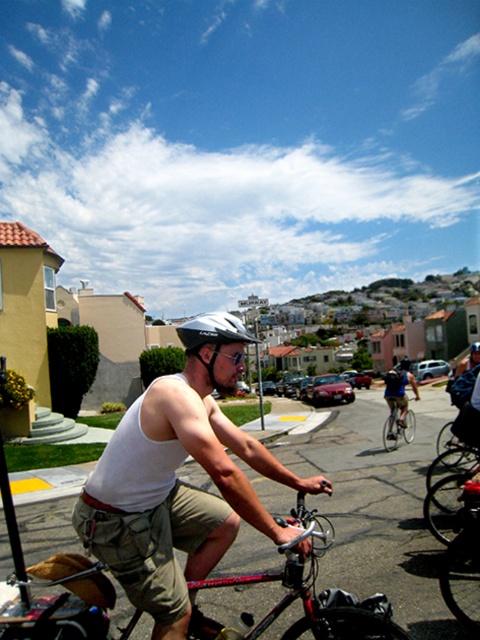
You are a delivery person who needs to carry a matte black backpack at center and a metallic silver bicycle at center through a narrow alley that is only 1.2 meters wide. Based on their sizes, can both items fit side by side without overlapping?

The matte black backpack at center might be wider than metallic silver bicycle at center, so it is uncertain if both items can fit side by side in the 1.2 meters wide alley. You should check their exact widths before attempting to pass through.

You are standing at the point labeled point (398, 422) and want to move towards the point labeled point (407, 412). Which direction should you move to get closer to that point?

You should move towards the point labeled point (407, 412) by moving forward since it is closer to the camera, meaning it is in front of your current position at point (398, 422).

You are a pedestrian standing on the sidewalk observing the cyclists. You notice the cyclist wearing both a white matte tank top at center and a camouflage fabric vest at center. Which clothing item is positioned higher on his body?

The white matte tank top at center is located above the camouflage fabric vest at center, so it is positioned higher on his body.